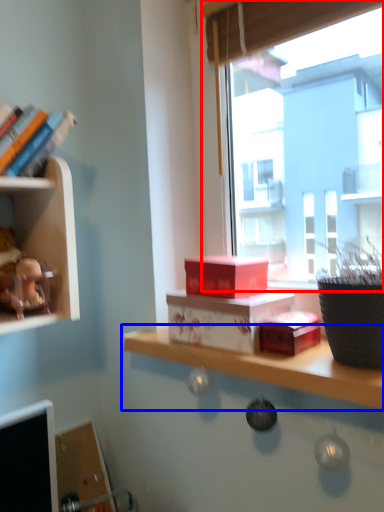
Question: Which of the following is the farthest to the observer, window (highlighted by a red box) or shelf (highlighted by a blue box)?

Choices:
 (A) window
 (B) shelf

Answer: (A)